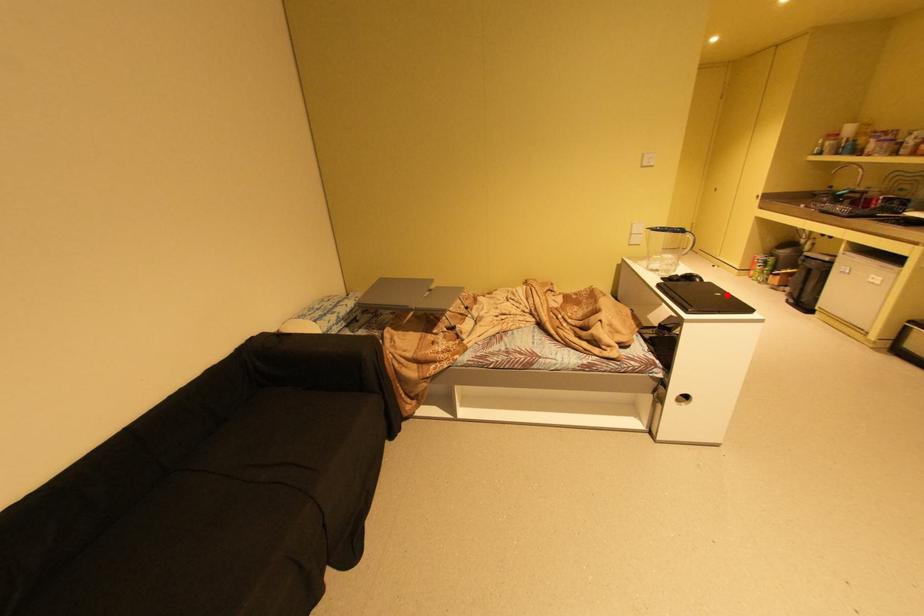
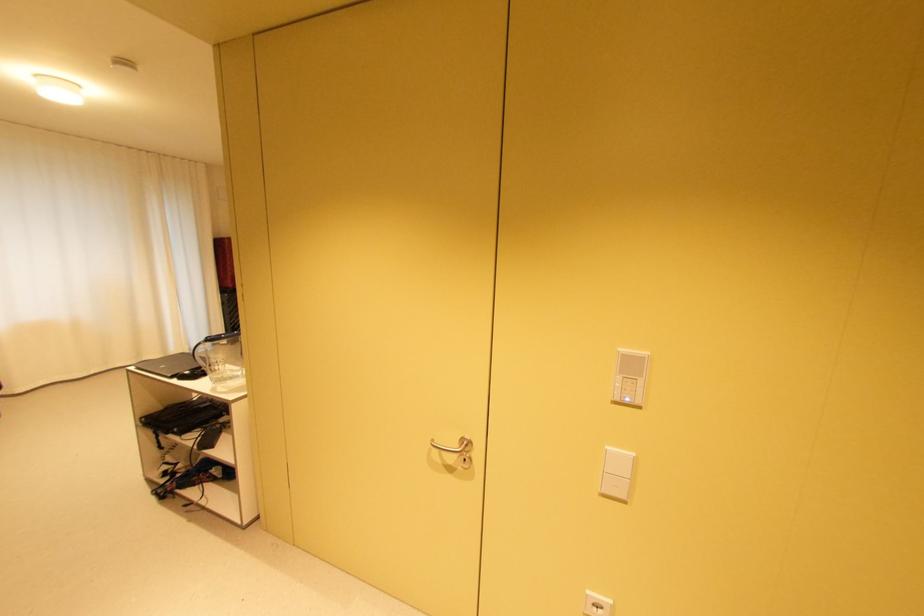
Locate, in the second image, the point that corresponds to the highlighted location in the first image.

(171, 367)